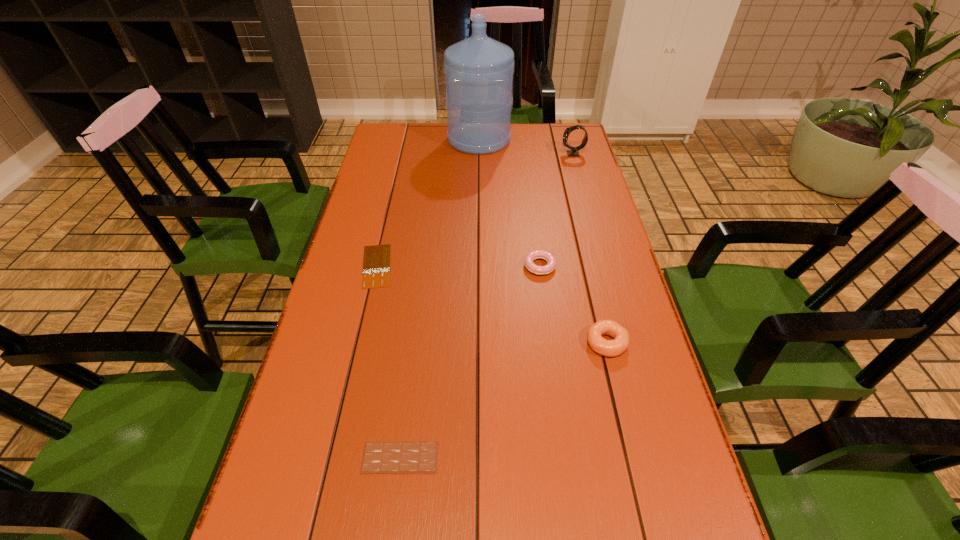
Locate an element on the screen. watch situated at the right edge is located at coordinates (574, 152).

This screenshot has height=540, width=960. I want to click on doughnut positioned at the right edge, so click(610, 348).

At what (x,y) coordinates should I click in order to perform the action: click on object located at the far right corner. Please return your answer as a coordinate pair (x, y). This screenshot has width=960, height=540. Looking at the image, I should click on (574, 152).

The width and height of the screenshot is (960, 540). Find the location of `vacant space at the far edge`. vacant space at the far edge is located at coordinates (419, 148).

This screenshot has height=540, width=960. Identify the location of vacant space at the left edge. (386, 174).

In the image, there is a desktop. At what (x,y) coordinates should I click in order to perform the action: click on vacant space at the right edge. Please return your answer as a coordinate pair (x, y). Looking at the image, I should click on coord(599,314).

I want to click on vacant space at the far left corner of the desktop, so click(389, 127).

Identify the location of vacant space at the far right corner of the desktop. The height and width of the screenshot is (540, 960). (550, 140).

Identify the location of vacant area that lies between the fifth shortest object and the shorter doughnut. The height and width of the screenshot is (540, 960). (556, 210).

Locate an element on the screen. vacant area that lies between the right doughnut and the taller chocolate bar is located at coordinates (503, 400).